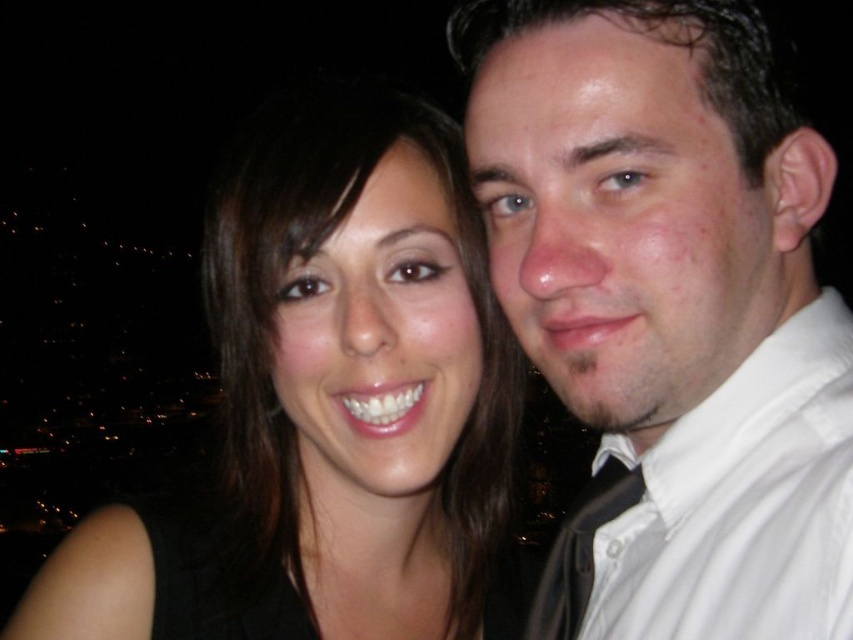
Who is higher up, black matte hair at upper left or white cotton shirt at right?

Positioned higher is black matte hair at upper left.

Measure the distance between point (491, 572) and camera.

They are 1.49 meters apart.

Identify the location of black matte hair at upper left. (329, 403).

Is white shirt at right above black matte hair at upper left?

Indeed, white shirt at right is positioned over black matte hair at upper left.

Can you confirm if white shirt at right is bigger than black matte hair at upper left?

No.

The image size is (853, 640). I want to click on white shirt at right, so click(x=669, y=310).

Is white shirt at right below white cotton shirt at right?

No, white shirt at right is not below white cotton shirt at right.

Does white shirt at right lie behind white cotton shirt at right?

Yes.

Which is in front, point (769, 548) or point (813, 330)?

Point (769, 548) is more forward.

What are the coordinates of `white shirt at right` in the screenshot? It's located at (669, 310).